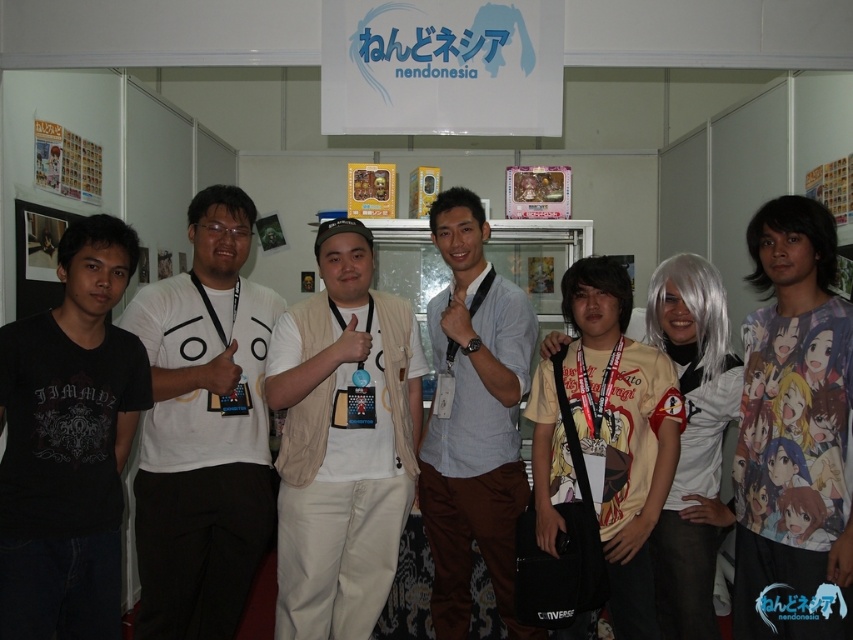
Who is lower down, white matte t-shirt at center or light blue shirt at center?

light blue shirt at center

How much distance is there between white matte t-shirt at center and light blue shirt at center?

27.47 inches

Find the location of a particular element. The width and height of the screenshot is (853, 640). white matte t-shirt at center is located at coordinates (202, 429).

Between point (422, 358) and point (488, 492), which one is positioned behind?

The point (422, 358) is behind.

Does point (339, 545) come in front of point (520, 504)?

Yes, point (339, 545) is in front of point (520, 504).

Which is behind, point (281, 480) or point (492, 419)?

The point (492, 419) is behind.

In order to click on beige fabric vest at center in this screenshot , I will do `click(341, 442)`.

Who is positioned more to the left, white matte t-shirt at center or beige fabric vest at center?

From the viewer's perspective, white matte t-shirt at center appears more on the left side.

Can you confirm if white matte t-shirt at center is positioned above beige fabric vest at center?

Yes, white matte t-shirt at center is above beige fabric vest at center.

What are the coordinates of `white matte t-shirt at center` in the screenshot? It's located at (202, 429).

The width and height of the screenshot is (853, 640). What are the coordinates of `white matte t-shirt at center` in the screenshot? It's located at (202, 429).